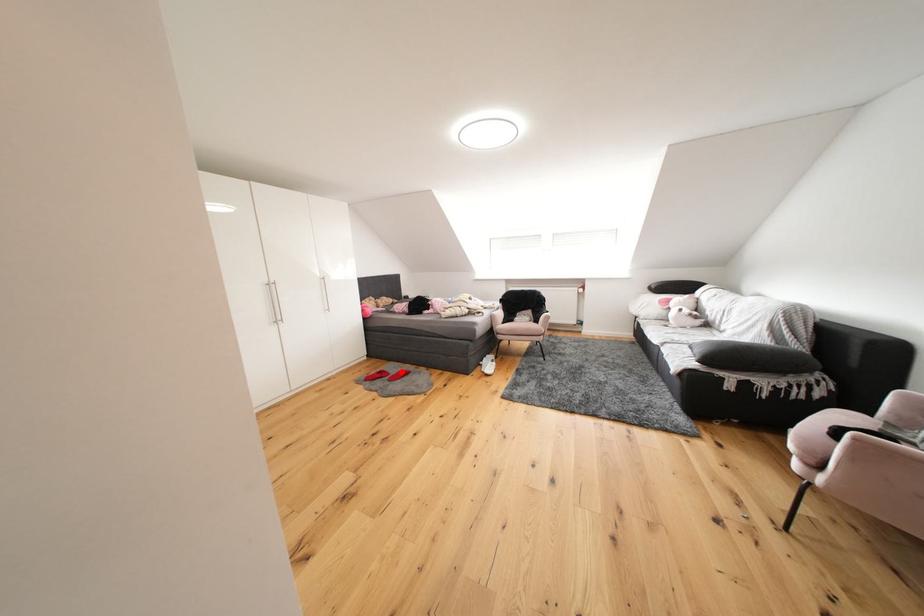
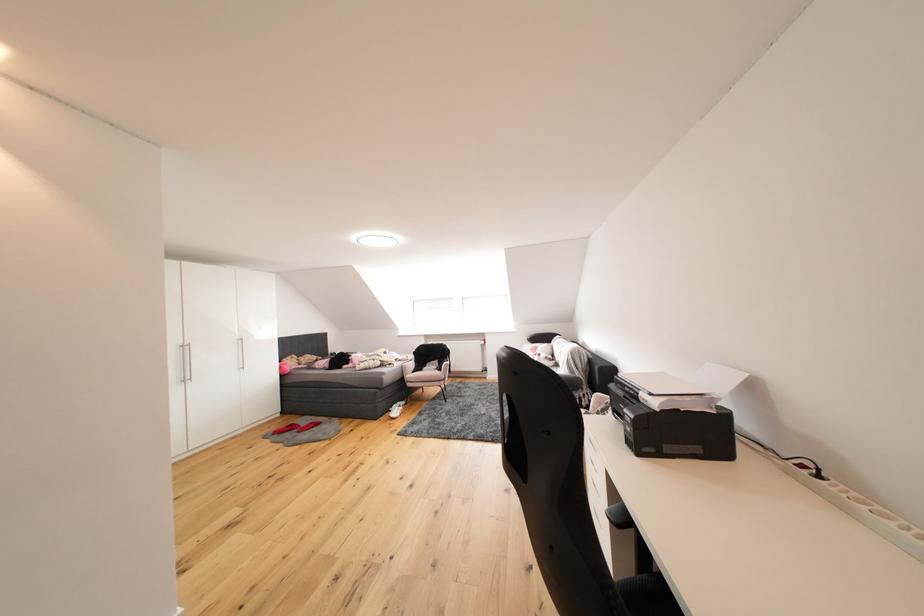
Find the pixel in the second image that matches the highlighted location in the first image.

(313, 424)